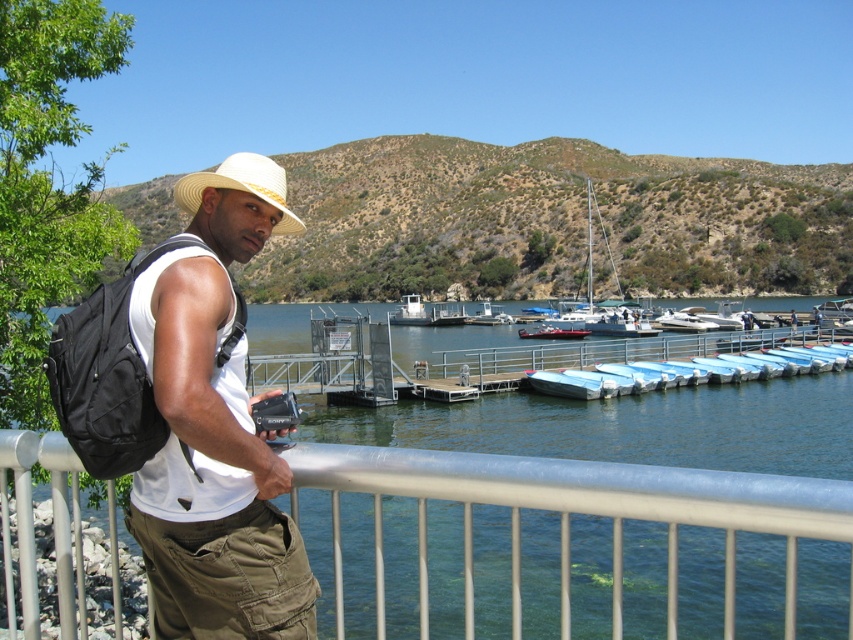
Can you confirm if silver metallic fence at lower center is smaller than metallic silver boat at center?

Yes, silver metallic fence at lower center is smaller than metallic silver boat at center.

Is point (619, 636) farther from camera compared to point (556, 326)?

No.

The height and width of the screenshot is (640, 853). I want to click on silver metallic fence at lower center, so click(570, 515).

At what (x,y) coordinates should I click in order to perform the action: click on white matte hat at upper left. Please return your answer as a coordinate pair (x, y). Looking at the image, I should click on (215, 428).

Who is shorter, white matte hat at upper left or white sailboat at center?

Standing shorter between the two is white matte hat at upper left.

Does point (207, 378) lie behind point (573, 310)?

No.

Image resolution: width=853 pixels, height=640 pixels. Identify the location of white matte hat at upper left. (215, 428).

Does white matte hat at upper left have a larger size compared to metallic silver boat at center?

Yes, white matte hat at upper left is bigger than metallic silver boat at center.

Does white matte hat at upper left appear under metallic silver boat at center?

Actually, white matte hat at upper left is above metallic silver boat at center.

Identify the location of white matte hat at upper left. (215, 428).